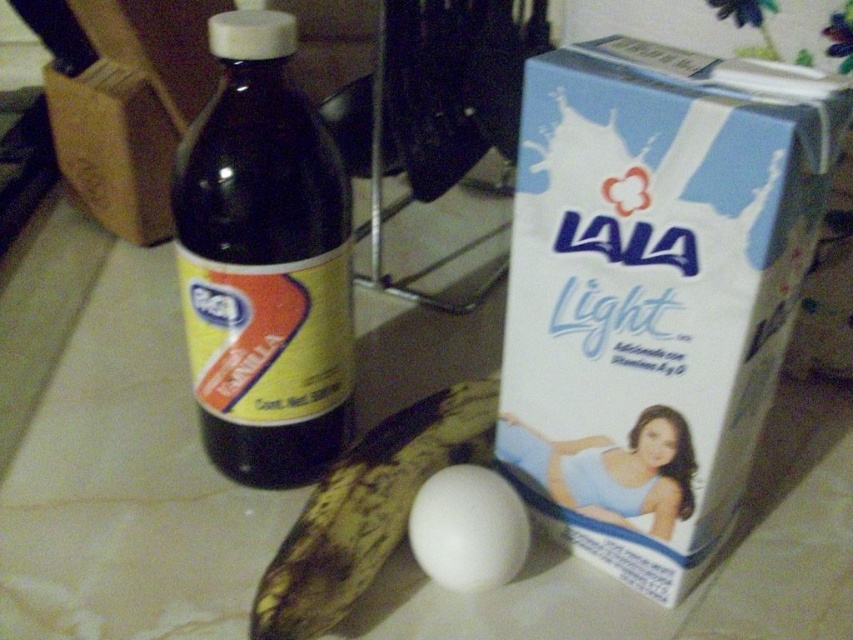
Question: From the image, what is the correct spatial relationship of dark glass bottle at center in relation to yellow matte banana at center?

Choices:
 (A) left
 (B) right

Answer: (A)

Question: Observing the image, what is the correct spatial positioning of white cardboard box at right in reference to white smooth egg at center?

Choices:
 (A) below
 (B) above

Answer: (B)

Question: Which point is closer to the camera?

Choices:
 (A) white cardboard box at right
 (B) yellow matte banana at center

Answer: (A)

Question: Which point is closer to the camera taking this photo?

Choices:
 (A) (701, 156)
 (B) (460, 506)

Answer: (A)

Question: Which of the following is the closest to the observer?

Choices:
 (A) white smooth egg at center
 (B) yellow matte banana at center

Answer: (B)

Question: Can you confirm if white cardboard box at right is bigger than dark glass bottle at center?

Choices:
 (A) yes
 (B) no

Answer: (B)